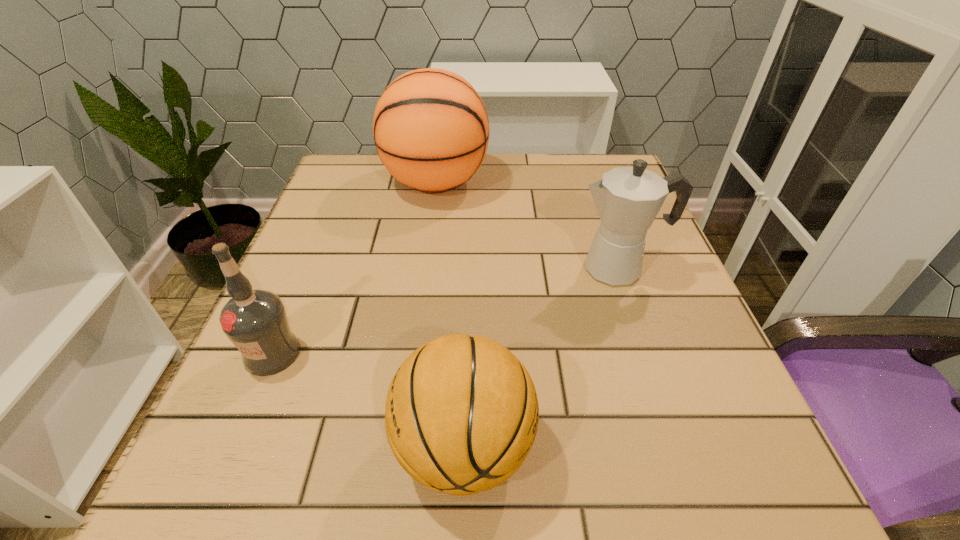
In the image, there is a desktop. At what (x,y) coordinates should I click in order to perform the action: click on vacant area at the left edge. Please return your answer as a coordinate pair (x, y). This screenshot has width=960, height=540. Looking at the image, I should click on (346, 205).

Where is `blank area at the right edge`? The width and height of the screenshot is (960, 540). blank area at the right edge is located at coordinates (588, 243).

You are a GUI agent. You are given a task and a screenshot of the screen. Output one action in this format:
    pyautogui.click(x=<x>, y=<y>)
    Task: Click on the vacant region at the far left corner of the desktop
    This screenshot has height=540, width=960.
    Given the screenshot: What is the action you would take?
    pyautogui.click(x=360, y=176)

In the image, there is a desktop. Where is `vacant space at the near left corner`? This screenshot has height=540, width=960. vacant space at the near left corner is located at coordinates (204, 497).

The width and height of the screenshot is (960, 540). In order to click on vacant area at the far right corner of the desktop in this screenshot , I will do `click(584, 181)`.

At what (x,y) coordinates should I click in order to perform the action: click on free region at the near right corner of the desktop. Please return your answer as a coordinate pair (x, y). The image size is (960, 540). Looking at the image, I should click on (721, 517).

The image size is (960, 540). In order to click on free space between the farther basketball and the vodka in this screenshot , I will do `click(354, 268)`.

Find the location of a particular element. free point between the vodka and the shorter basketball is located at coordinates (368, 400).

This screenshot has width=960, height=540. Identify the location of empty location between the vodka and the farthest object. (354, 268).

Locate an element on the screen. The width and height of the screenshot is (960, 540). empty space between the shorter basketball and the rightmost object is located at coordinates (540, 358).